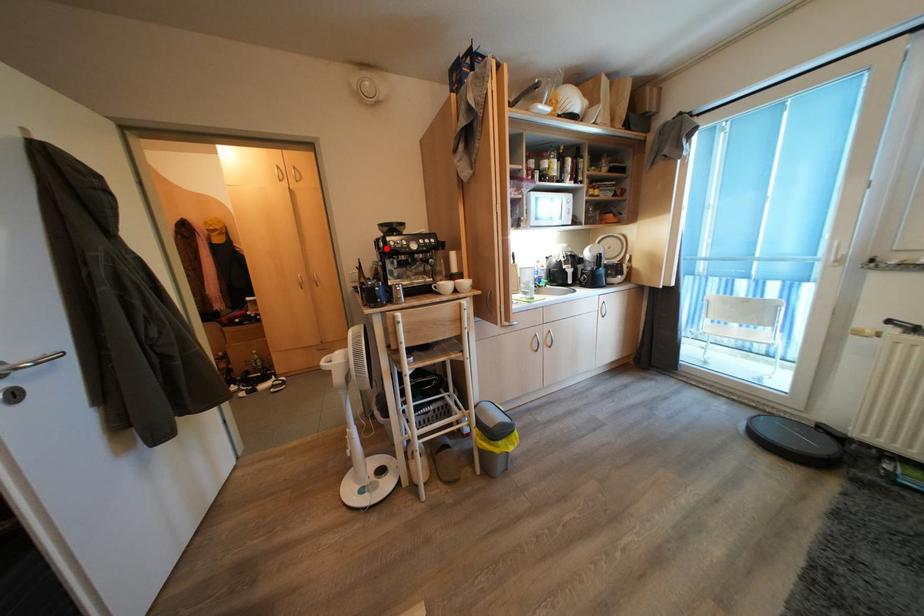
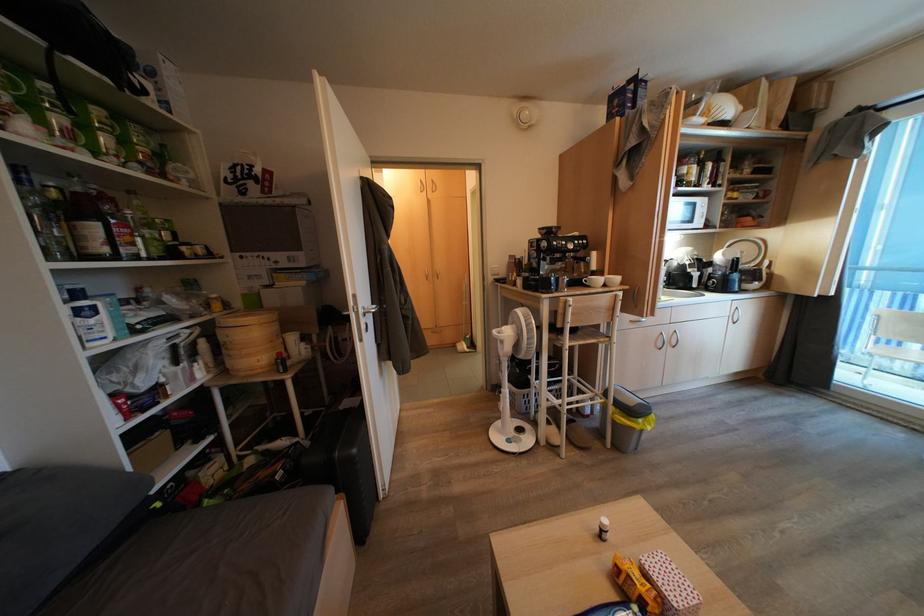
The point at the highlighted location is marked in the first image. Where is the corresponding point in the second image?

(549, 248)